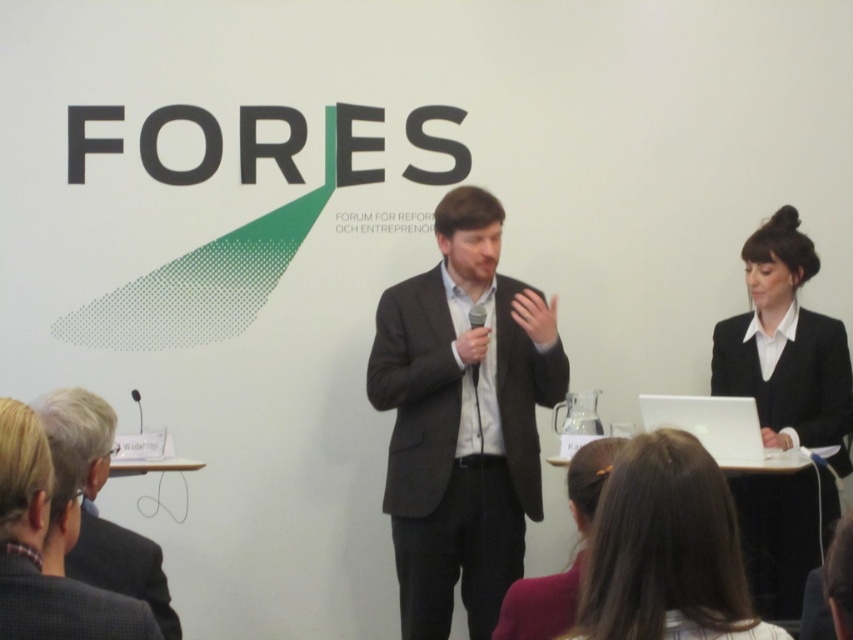
Can you confirm if dark gray suit at center is smaller than gray fabric suit at lower left?

No.

Can you confirm if dark gray suit at center is shorter than gray fabric suit at lower left?

No, dark gray suit at center is not shorter than gray fabric suit at lower left.

Measure the distance between dark gray suit at center and camera.

dark gray suit at center is 3.13 meters away from camera.

The height and width of the screenshot is (640, 853). What are the coordinates of `dark gray suit at center` in the screenshot? It's located at (462, 419).

Between brown hair at center and dark gray suit at lower left, which one has more height?

With more height is brown hair at center.

Does brown hair at center come behind dark gray suit at lower left?

That is False.

At what (x,y) coordinates should I click in order to perform the action: click on brown hair at center. Please return your answer as a coordinate pair (x, y). The image size is (853, 640). Looking at the image, I should click on (665, 550).

Which is more to the left, white glossy shirt at upper right or dark gray suit at lower left?

From the viewer's perspective, dark gray suit at lower left appears more on the left side.

Does point (753, 486) lie behind point (122, 540)?

Yes, point (753, 486) is behind point (122, 540).

Describe the element at coordinates (785, 346) in the screenshot. The width and height of the screenshot is (853, 640). I see `white glossy shirt at upper right` at that location.

Find the location of a particular element. white glossy shirt at upper right is located at coordinates (785, 346).